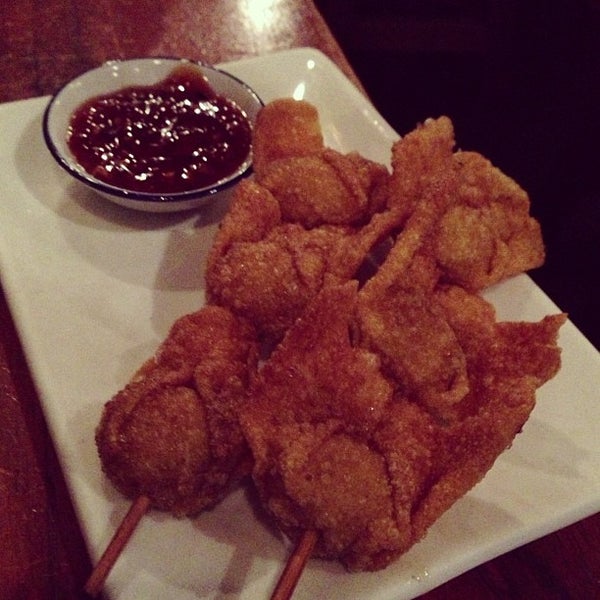
Identify the location of white rectangular ceramic serving platter. (76, 277).